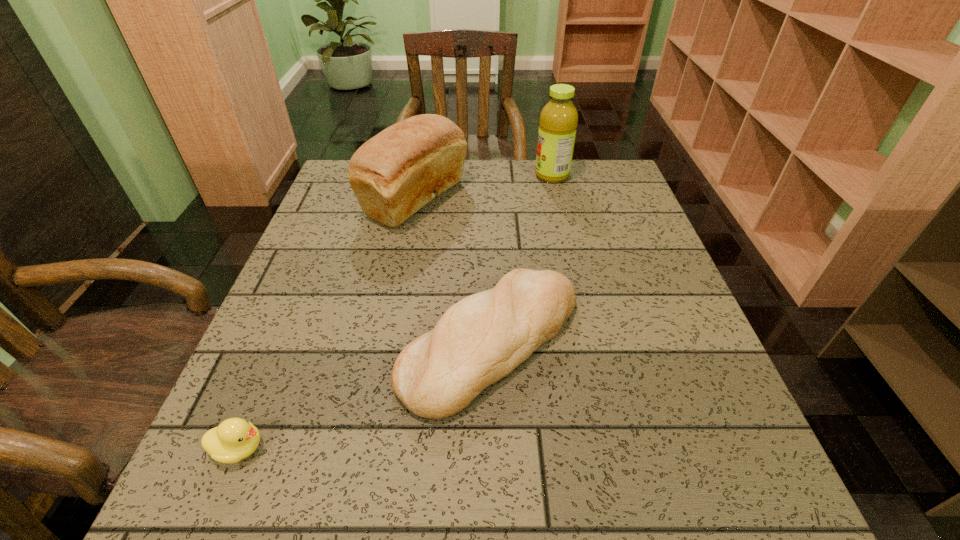
This screenshot has width=960, height=540. I want to click on vacant area that lies between the duckling and the tallest object, so click(396, 312).

Locate an element on the screen. The image size is (960, 540). blank region between the third tallest object and the leftmost object is located at coordinates (365, 396).

Locate an element on the screen. The width and height of the screenshot is (960, 540). unoccupied area between the tallest object and the nearer bread is located at coordinates (521, 259).

Where is `vacant area that lies between the fruit juice and the duckling`? This screenshot has width=960, height=540. vacant area that lies between the fruit juice and the duckling is located at coordinates (396, 312).

This screenshot has width=960, height=540. Identify the location of empty space that is in between the farther bread and the third farthest object. (453, 271).

Where is `free space that is in between the leftmost object and the tallest object`? The height and width of the screenshot is (540, 960). free space that is in between the leftmost object and the tallest object is located at coordinates (396, 312).

This screenshot has width=960, height=540. What are the coordinates of `free space between the leftmost object and the farther bread` in the screenshot? It's located at (327, 324).

You are a GUI agent. You are given a task and a screenshot of the screen. Output one action in this format:
    pyautogui.click(x=<x>, y=<y>)
    Task: Click on the vacant space that is in between the fruit juice and the duckling
    This screenshot has width=960, height=540.
    Given the screenshot: What is the action you would take?
    pyautogui.click(x=396, y=312)

This screenshot has width=960, height=540. I want to click on object that is the second closest to the second nearest object, so click(235, 439).

Point out which object is positioned as the second nearest to the leftmost object. Please provide its 2D coordinates. Your answer should be formatted as a tuple, i.e. [(x, y)], where the tuple contains the x and y coordinates of a point satisfying the conditions above.

[(394, 174)]